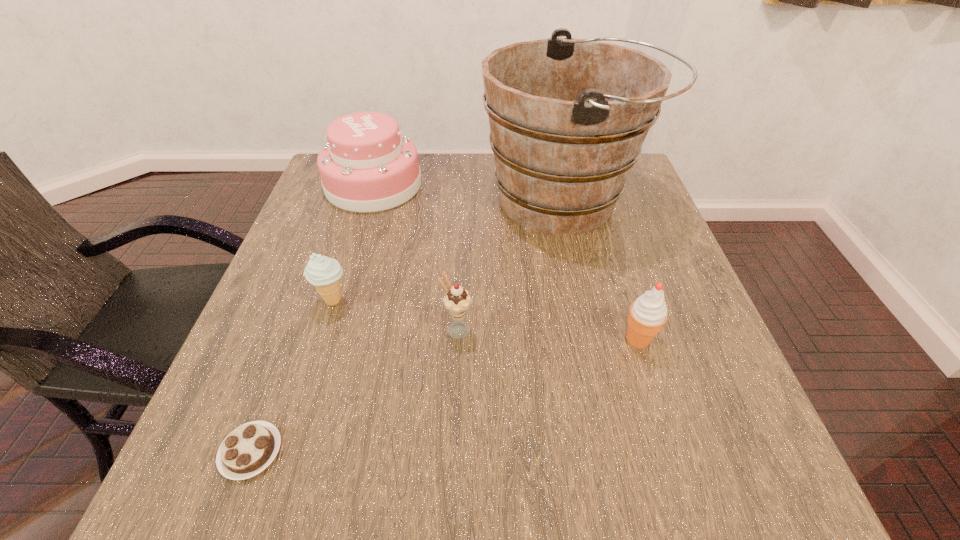
I want to click on icecream located in the right edge section of the desktop, so click(648, 313).

Where is `object situated at the far left corner`? object situated at the far left corner is located at coordinates (367, 165).

Find the location of a particular element. This screenshot has height=540, width=960. object at the near left corner is located at coordinates (250, 448).

The image size is (960, 540). I want to click on object that is positioned at the far right corner, so click(x=568, y=117).

In the image, there is a desktop. Where is `vacant space at the far edge`? vacant space at the far edge is located at coordinates (486, 196).

In the image, there is a desktop. Identify the location of free space at the near edge. The height and width of the screenshot is (540, 960). (514, 483).

This screenshot has width=960, height=540. I want to click on vacant space at the left edge, so click(x=271, y=337).

The height and width of the screenshot is (540, 960). In the image, there is a desktop. What are the coordinates of `vacant area at the right edge` in the screenshot? It's located at (657, 248).

Find the location of `unoccupied area between the farthest icecream and the rightmost icecream`. unoccupied area between the farthest icecream and the rightmost icecream is located at coordinates (486, 320).

You are a GUI agent. You are given a task and a screenshot of the screen. Output one action in this format:
    pyautogui.click(x=<x>, y=<y>)
    Task: Click on the free space between the rightmost icecream and the cake
    The image size is (960, 540).
    Given the screenshot: What is the action you would take?
    pyautogui.click(x=506, y=262)